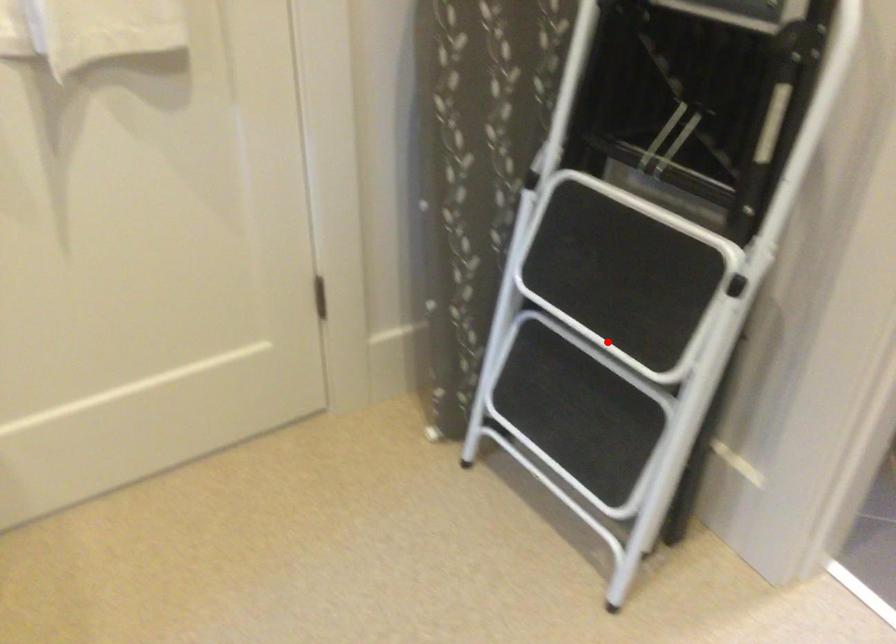
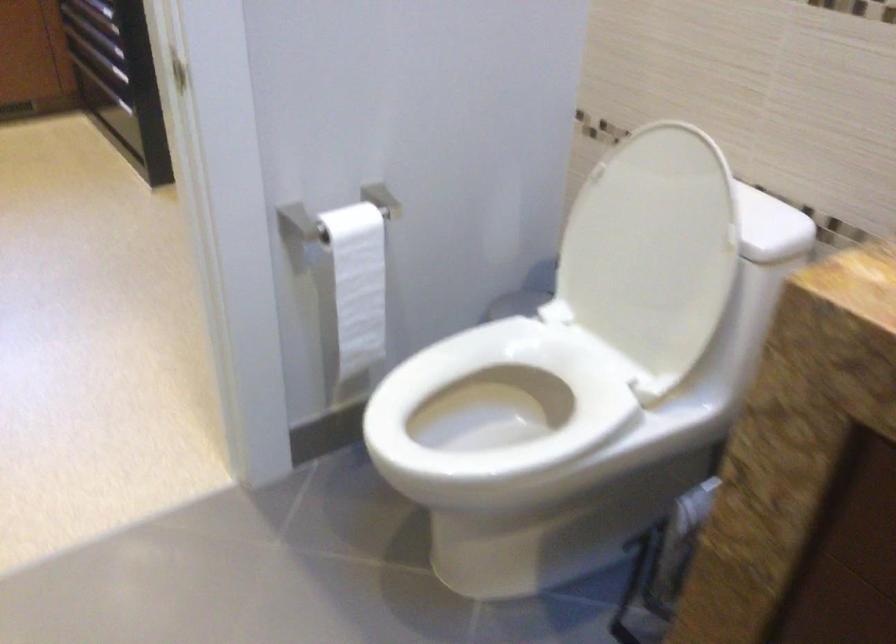
Question: I am providing you with two images of the same scene from different viewpoints. A red point is marked on the first image. Is the red point's position out of view in image 2?

Choices:
 (A) Yes
 (B) No

Answer: (A)